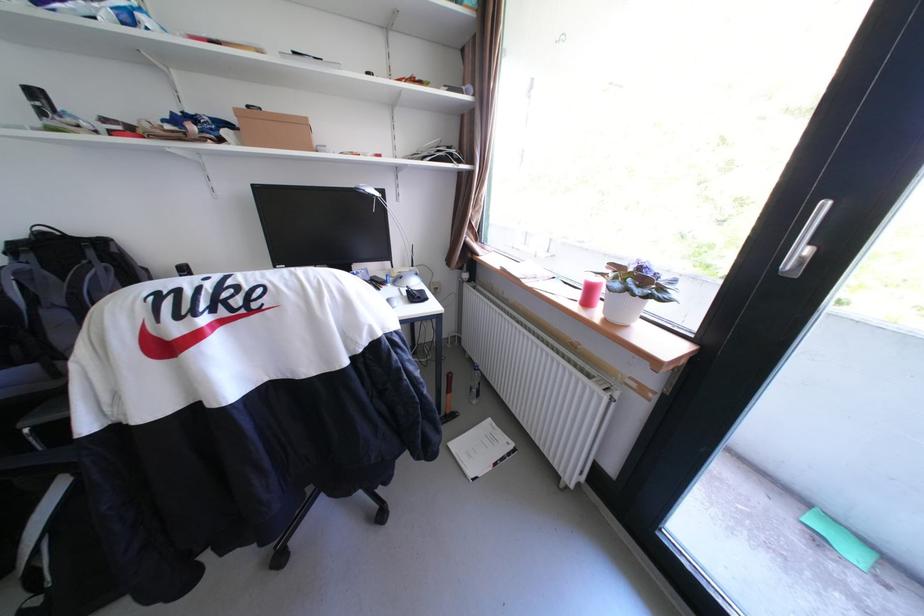
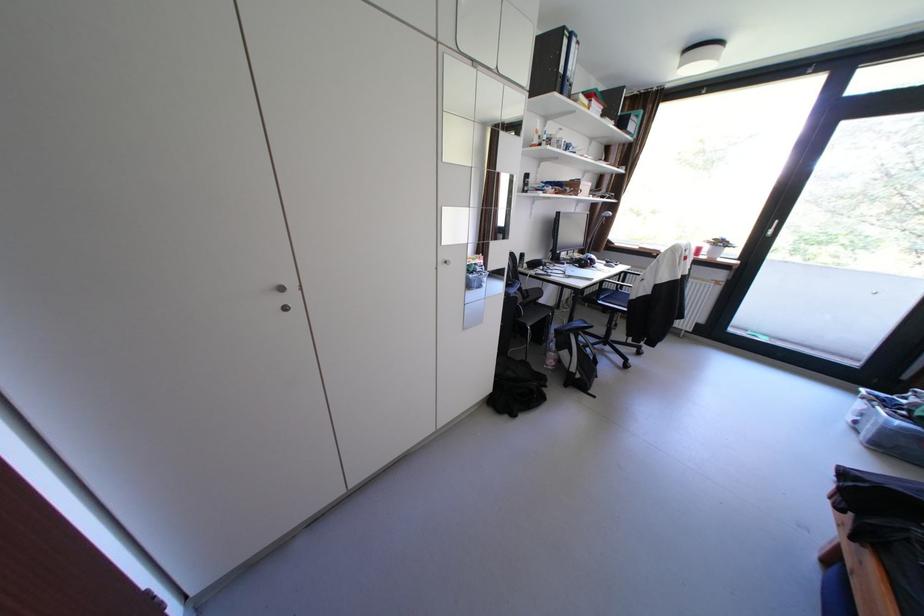
In the second image, find the point that corresponds to point (382, 198) in the first image.

(614, 217)